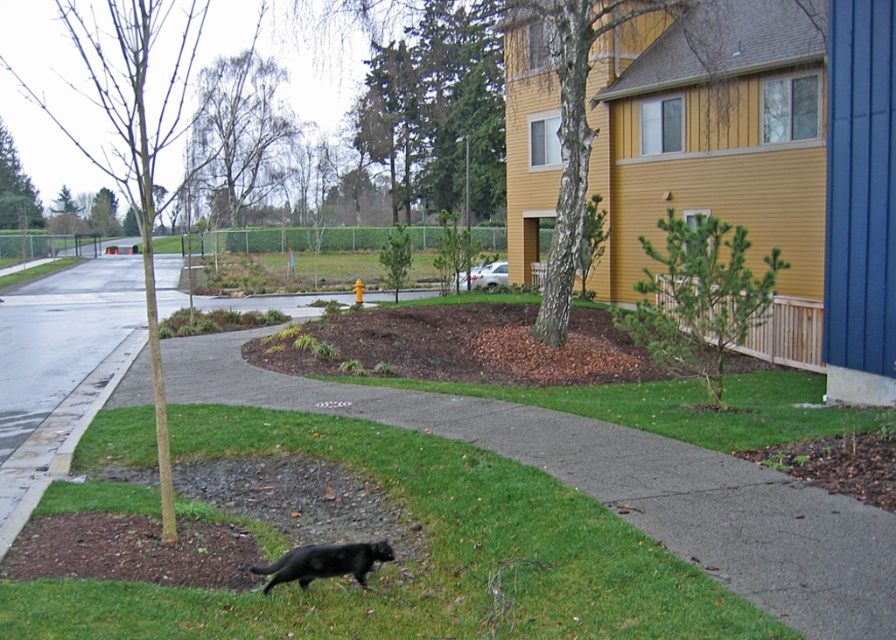
You are standing at the edge of the pathway and want to reach the brown mulch at center. Which direction should you move relative to the black furry cat at lower center?

The brown mulch at center is further to the viewer than the black furry cat at lower center, so you should move forward away from the cat to reach the mulch.

You are a gardener who wants to place a new flower pot between the brown mulch at center and the black furry cat at lower center. Which object should you place the flower pot closer to to ensure it doesn

The flower pot should be placed closer to the black furry cat at lower center because the brown mulch at center is wider than the black furry cat at lower center, so the cat is narrower and the flower pot can be placed closer to it without overlapping.